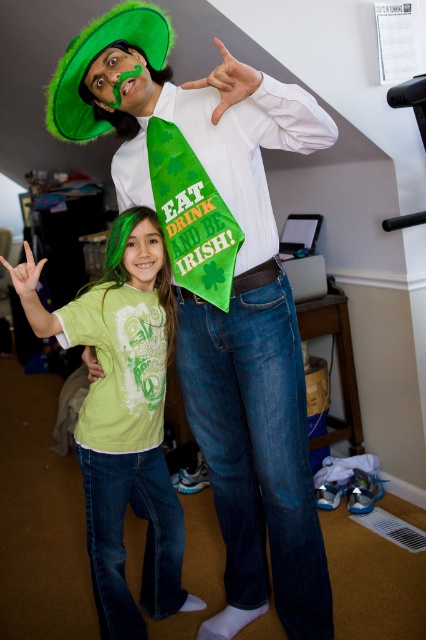
You are standing at the point labeled point (72,77). You want to throw a small ball to a friend who is standing 5 feet away from you. Can you reach your friend with the throw?

The distance between point (72,77) and the viewer is 4.83 feet, so yes, you can reach your friend with the throw since the distance is slightly less than 5 feet.

You are a photographer taking a picture of the two people in the scene. You notice the green matte mustache at center and the matte green face at center. Which one is located to the left of the other?

The green matte mustache at center is positioned on the left side of matte green face at center.

You are standing in a crowded St. Patrick Day parade. There is a point at coordinates point (120, 104) that you want to reach. Can you estimate how far you need to walk to get there?

The distance between point (120, 104) and the viewer is 1.47 meters, so you need to walk approximately 1.47 meters to reach that point.